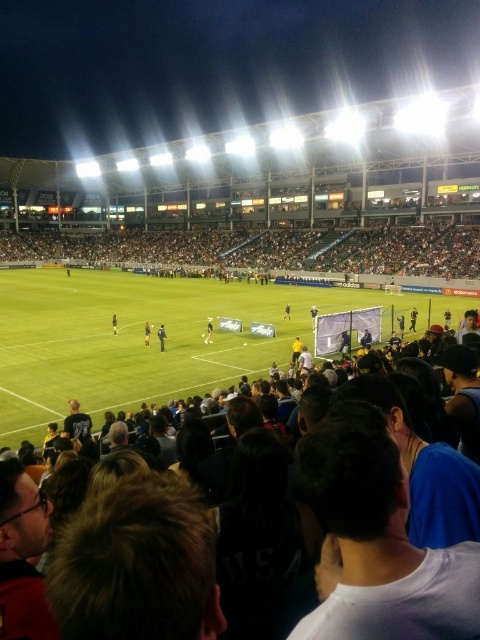
Describe the element at coordinates (251, 355) in the screenshot. I see `dark hair at center` at that location.

Can you confirm if dark hair at center is positioned below black jersey at center?

Correct, dark hair at center is located below black jersey at center.

Does point (51, 314) come closer to viewer compared to point (210, 339)?

No, (51, 314) is behind (210, 339).

This screenshot has height=640, width=480. I want to click on dark hair at center, so [251, 355].

Who is positioned more to the right, green grass football field at center or dark hair at center?

green grass football field at center

Is the position of green grass football field at center less distant than that of dark hair at center?

No, green grass football field at center is behind dark hair at center.

Who is more distant from viewer, (x=194, y=353) or (x=136, y=401)?

Point (x=194, y=353)

Where is `green grass football field at center`? The height and width of the screenshot is (640, 480). green grass football field at center is located at coordinates (152, 339).

Between dark blue uniform at center and black jersey at center, which one is positioned higher?

black jersey at center is above.

Who is more distant from viewer, (159, 337) or (211, 326)?

Point (211, 326)

Find the location of `dark blue uniform at center`. dark blue uniform at center is located at coordinates (162, 337).